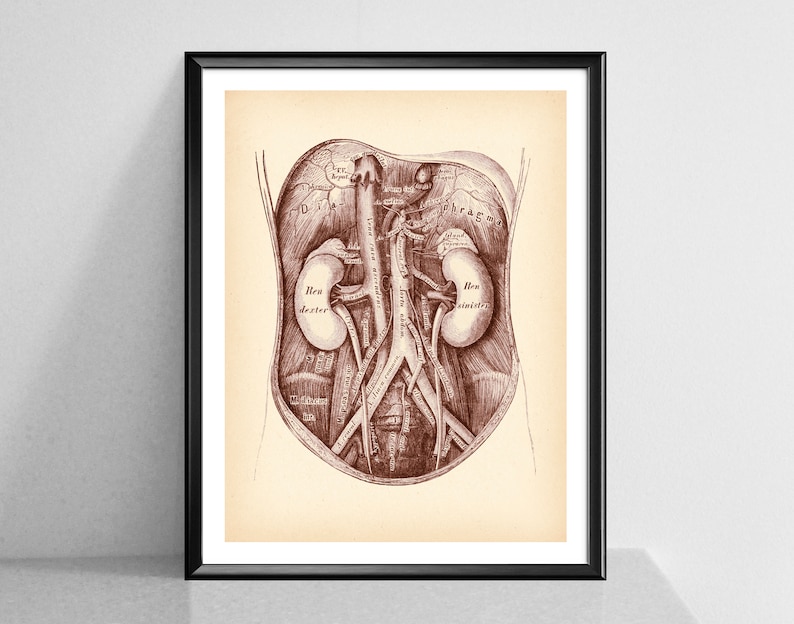
Where is `1 black frame`? 1 black frame is located at coordinates (588, 568).